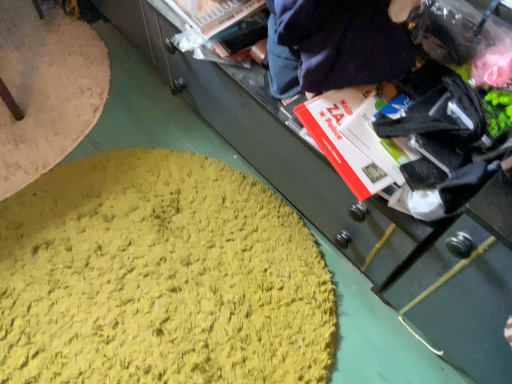
The width and height of the screenshot is (512, 384). In order to click on yellow textured rug at lower left in this screenshot , I will do `click(160, 277)`.

The image size is (512, 384). What do you see at coordinates (160, 277) in the screenshot?
I see `yellow textured rug at lower left` at bounding box center [160, 277].

From the picture: Measure the distance between point [87,232] and camera.

Point [87,232] is 3.73 feet away from camera.

Locate an element on the screen. yellow textured rug at lower left is located at coordinates (160, 277).